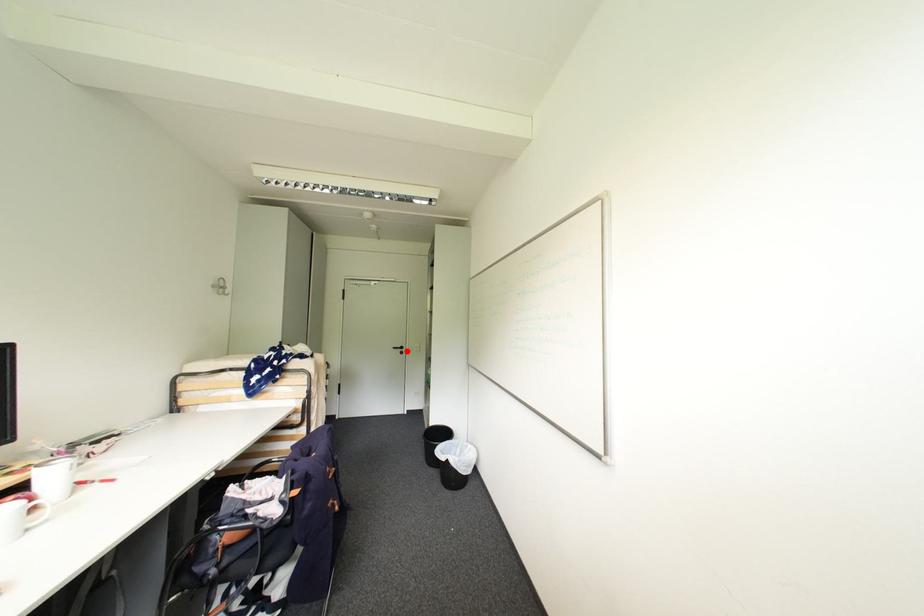
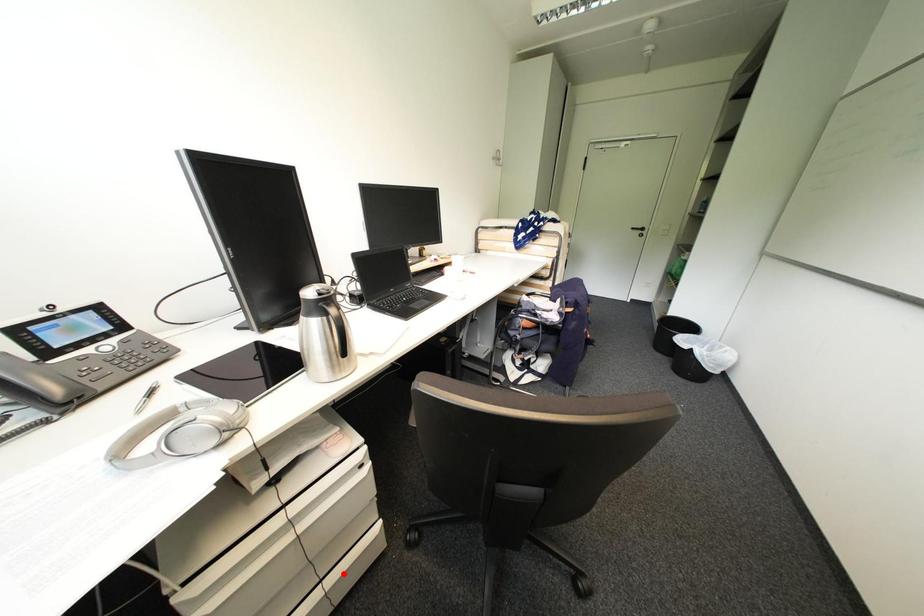
I am providing you with two images of the same scene from different viewpoints. A red point is marked on the first image and another point is marked on the second image. Are the points marked in image1 and image2 representing the same 3D position?

No